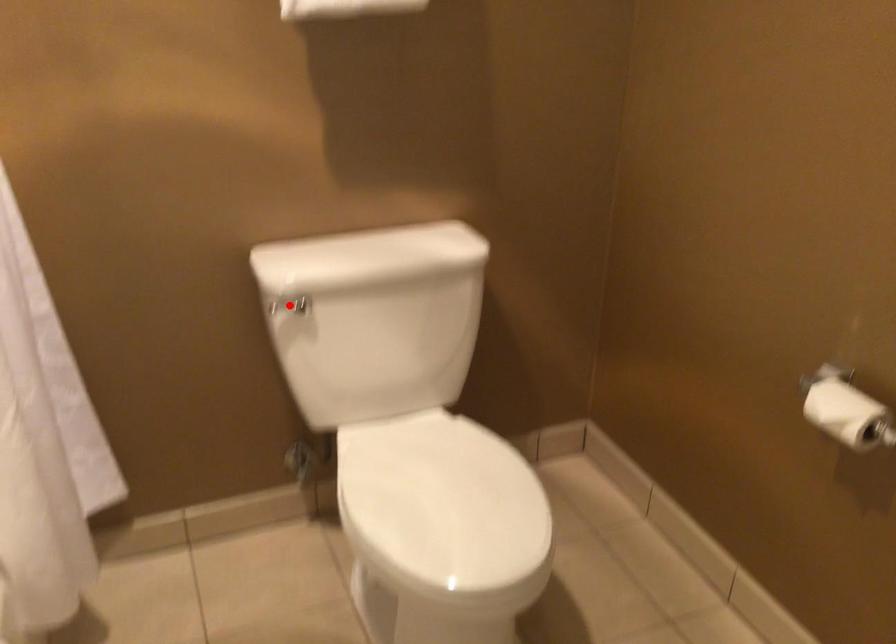
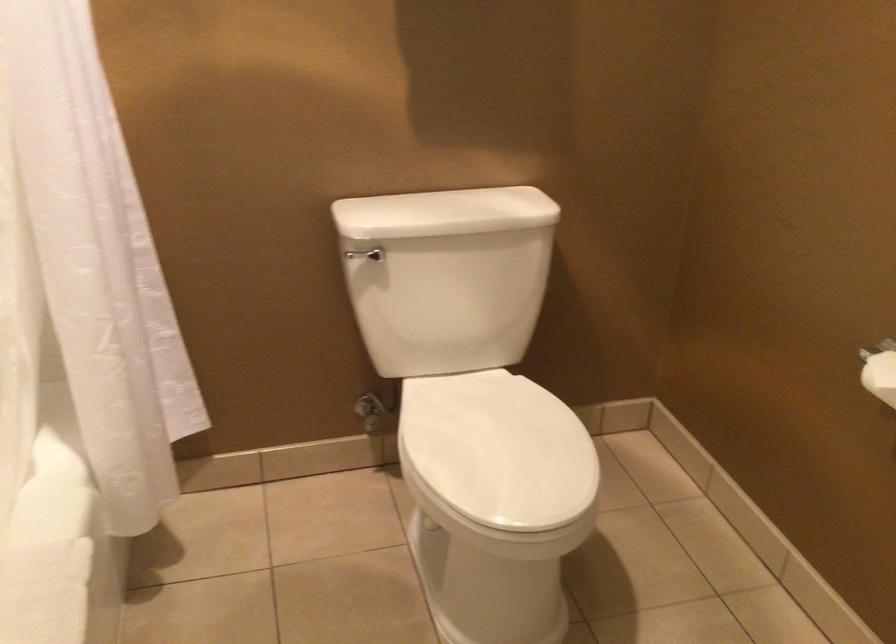
Locate, in the second image, the point that corresponds to the highlighted location in the first image.

(365, 254)